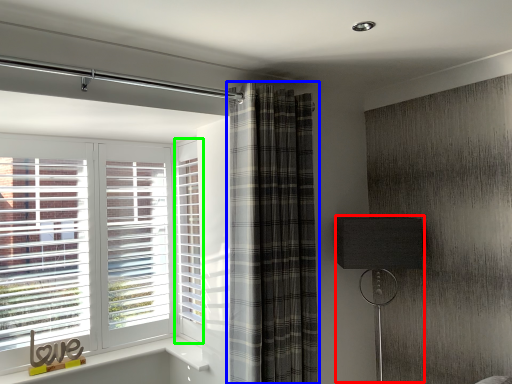
Question: Based on their relative distances, which object is farther from table lamp (highlighted by a red box)? Choose from curtain (highlighted by a blue box) and screen door (highlighted by a green box).

Choices:
 (A) curtain
 (B) screen door

Answer: (B)